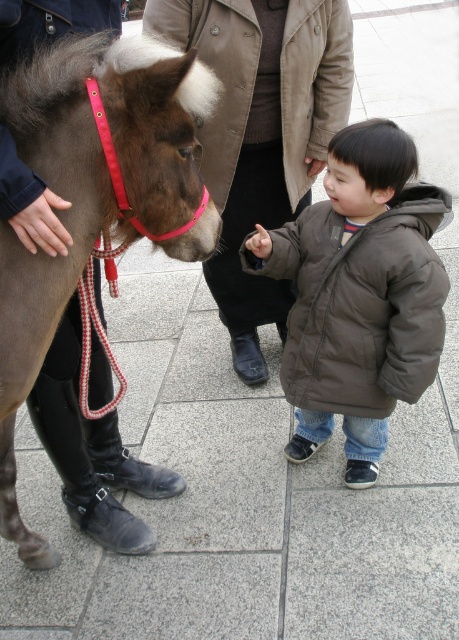
Measure the distance between point (206, 106) and camera.

Point (206, 106) is 6.14 feet away from camera.

Between brown leather mule at center and brown cotton jacket at center, which one appears on the right side from the viewer's perspective?

brown cotton jacket at center

Which is behind, point (78, 269) or point (231, 49)?

The point (231, 49) is more distant.

Where is `brown leather mule at center`? brown leather mule at center is located at coordinates (88, 195).

Can you confirm if brown puffy jacket at center is smaller than brown cotton jacket at center?

Correct, brown puffy jacket at center occupies less space than brown cotton jacket at center.

Does brown puffy jacket at center lie in front of brown cotton jacket at center?

No, it is behind brown cotton jacket at center.

The image size is (459, 640). In order to click on brown puffy jacket at center in this screenshot , I will do `click(360, 305)`.

The width and height of the screenshot is (459, 640). I want to click on brown puffy jacket at center, so click(360, 305).

Can you confirm if brown leather mule at center is bigger than brown puffy jacket at center?

Incorrect, brown leather mule at center is not larger than brown puffy jacket at center.

Based on the photo, who is more forward, (52, 269) or (403, 218)?

Point (52, 269) is more forward.

Who is more forward, (145,216) or (326,291)?

Positioned in front is point (145,216).

Where is `brown leather mule at center`? The image size is (459, 640). brown leather mule at center is located at coordinates (88, 195).